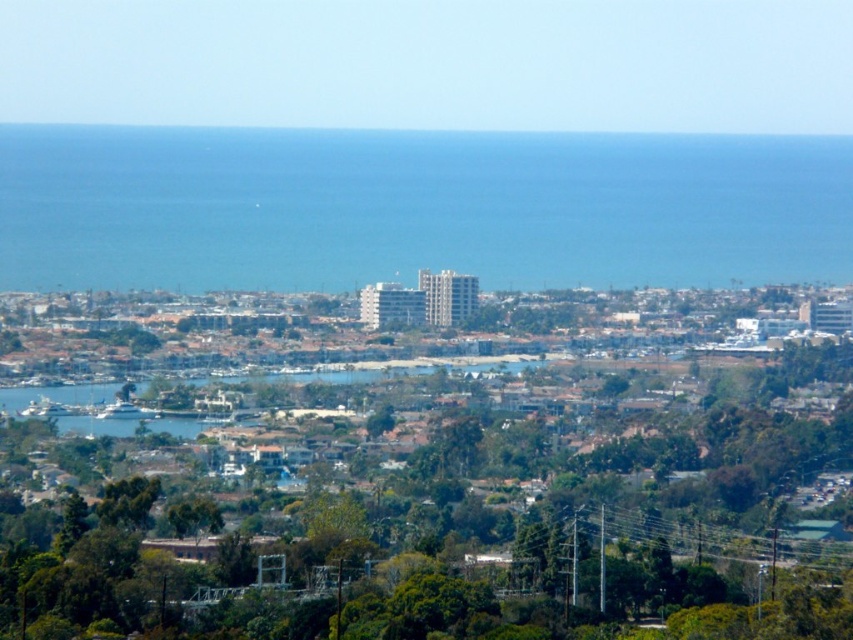
Does green leafy tree at center come in front of blue water at center?

No, green leafy tree at center is behind blue water at center.

Who is positioned more to the left, green leafy tree at center or blue water at center?

From the viewer's perspective, green leafy tree at center appears more on the left side.

Who is more forward, [439,588] or [612,189]?

Point [439,588]

Locate an element on the screen. The width and height of the screenshot is (853, 640). green leafy tree at center is located at coordinates (428, 529).